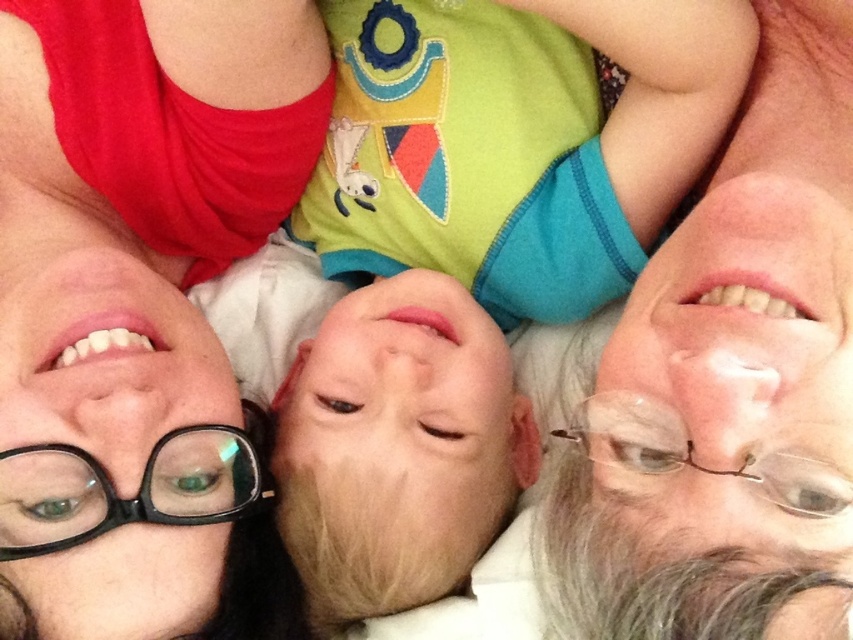
Question: Does matte black glasses at upper left have a larger size compared to gray hair at right?

Choices:
 (A) yes
 (B) no

Answer: (A)

Question: Estimate the real-world distances between objects in this image. Which object is farther from the matte black glasses at upper left?

Choices:
 (A) green fabric baby at center
 (B) gray hair at right

Answer: (B)

Question: Which point is closer to the camera?

Choices:
 (A) gray hair at right
 (B) matte black glasses at upper left
 (C) green fabric baby at center

Answer: (A)

Question: Can you confirm if green fabric baby at center is positioned to the right of matte black glasses at upper left?

Choices:
 (A) yes
 (B) no

Answer: (A)

Question: Estimate the real-world distances between objects in this image. Which object is farther from the matte black glasses at upper left?

Choices:
 (A) green fabric baby at center
 (B) gray hair at right

Answer: (B)

Question: Can you confirm if green fabric baby at center is positioned to the left of gray hair at right?

Choices:
 (A) yes
 (B) no

Answer: (A)